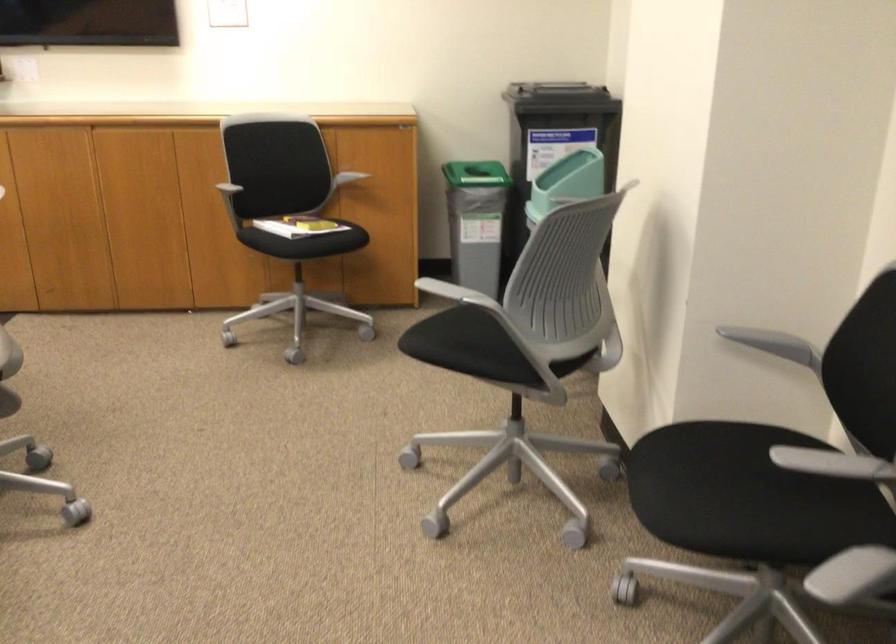
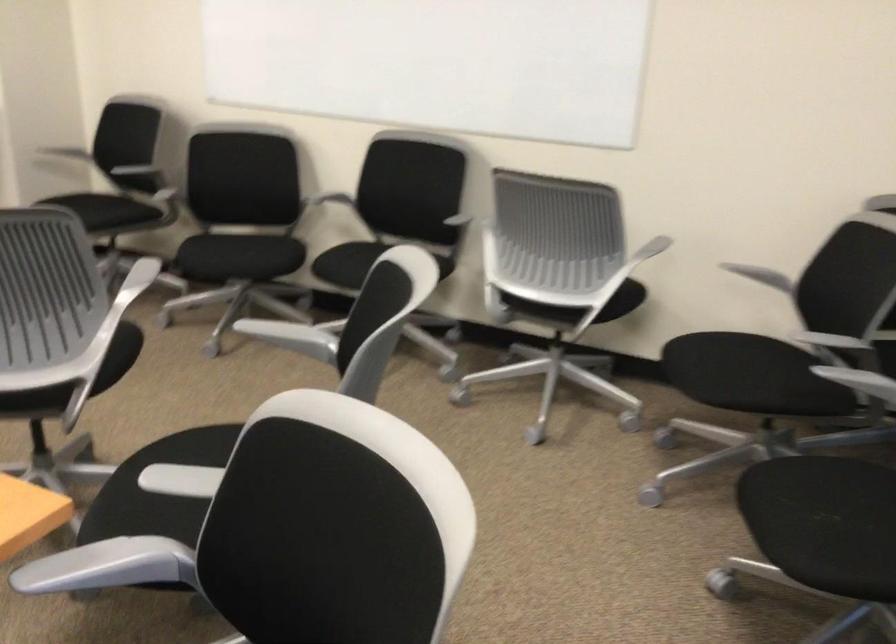
In the second image, find the point that corresponds to (x=787, y=351) in the first image.

(83, 149)